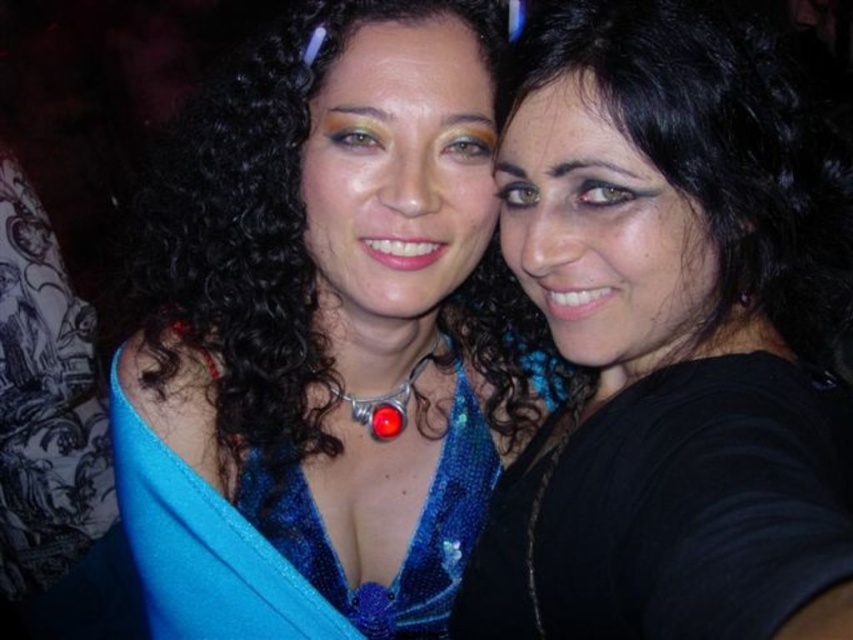
Question: Which is farther from the black matte hair at center?

Choices:
 (A) shiny blue sequined dress at center
 (B) blue sequined dress at center

Answer: (A)

Question: Is black matte hair at center closer to the viewer compared to shiny blue sequined dress at center?

Choices:
 (A) no
 (B) yes

Answer: (B)

Question: Does blue sequined dress at center have a greater width compared to shiny blue sequined dress at center?

Choices:
 (A) yes
 (B) no

Answer: (A)

Question: Which object is the farthest from the black matte hair at center?

Choices:
 (A) blue sequined dress at center
 (B) shiny blue sequined dress at center

Answer: (B)

Question: Which object appears closest to the camera in this image?

Choices:
 (A) blue sequined dress at center
 (B) shiny blue sequined dress at center

Answer: (A)

Question: From the image, what is the correct spatial relationship of black matte hair at center in relation to shiny blue sequined dress at center?

Choices:
 (A) right
 (B) left

Answer: (A)